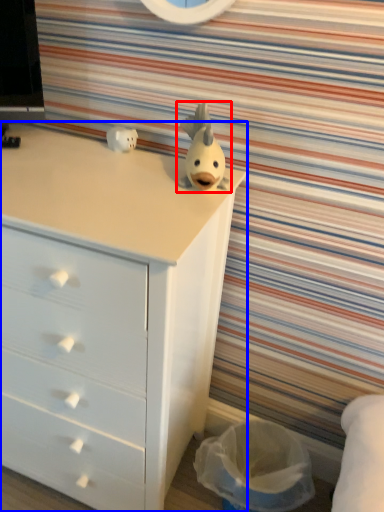
Question: Which of the following is the farthest to the observer, toy (highlighted by a red box) or chest of drawers (highlighted by a blue box)?

Choices:
 (A) toy
 (B) chest of drawers

Answer: (A)